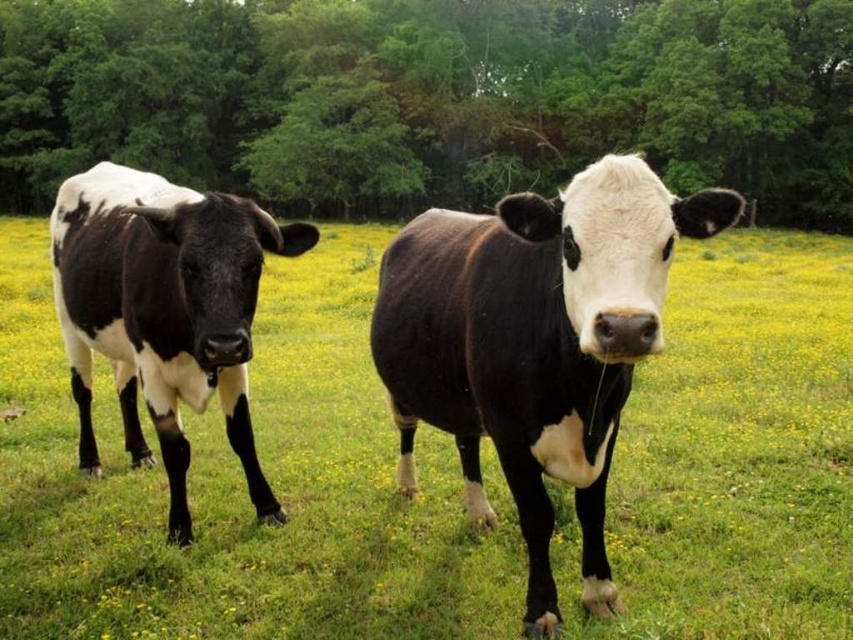
You are a farmer who needs to separate the black glossy cow at center from the black and white cow at left for feeding. Given that your fence can only extend 5 feet, can you place it between them to keep them apart?

The distance between the black glossy cow at center and the black and white cow at left is 8.15 feet. Since the fence can only extend 5 feet, it is not long enough to span the distance between them, so you cannot place it between them to keep them apart.

You are a farmer trying to locate the black glossy cow at center in the field. You have a map with a coordinate system where the bottom left corner is the origin. The coordinates of the point you are standing at are unknown. However, you know that the point you are standing at is 0.1 units to the left and 0.05 units above the point labeled as point [534,342]. Can you determine the coordinates of your current position?

The coordinates of your current position would be calculated by subtracting 0.1 from the x coordinate and adding 0.05 to the y coordinate of point [534,342]. Since point [534,342] corresponds to the black glossy cow at center, your current position is at coordinates 0.436, 0.677.

You are a photographer trying to capture a landscape shot of the green leafy tree at upper center. You want to ensure the tree is centered in your photo. Given the tree is at point 0.155 on the x and 0.506 on the y coordinates, what adjustments should you make to your camera position to center the tree?

The green leafy tree at upper center is already centered at coordinates 0.155 on the x and 0.506 on the y. Since the center of the image is typically at coordinates 0.5, you need to adjust your camera position to move the tree towards the center by moving it approximately 0.345 units on the x axis and 0.0 units on the y axis.